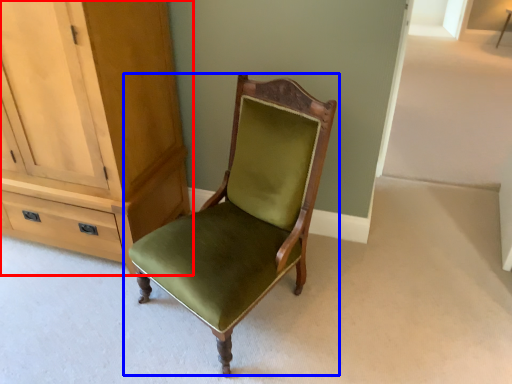
Question: Which of the following is the closest to the observer, cabinetry (highlighted by a red box) or chair (highlighted by a blue box)?

Choices:
 (A) cabinetry
 (B) chair

Answer: (B)